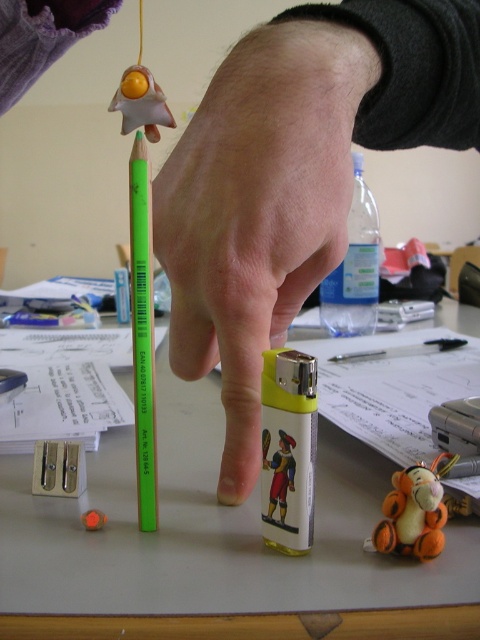
Question: Which object is the closest to the rubber eraser at center?

Choices:
 (A) green plastic pencil at center
 (B) yellow matte lighter at center

Answer: (A)

Question: Which point is farther from the camera taking this photo?

Choices:
 (A) (144, 490)
 (B) (88, 512)
 (C) (71, 515)

Answer: (C)

Question: Among these objects, which one is farthest from the camera?

Choices:
 (A) rubber eraser at center
 (B) green plastic pencil at center

Answer: (A)

Question: Considering the relative positions of yellow matte lighter at center and rubber eraser at center in the image provided, where is yellow matte lighter at center located with respect to rubber eraser at center?

Choices:
 (A) right
 (B) left

Answer: (A)

Question: Is white plastic table at center to the left of green plastic pencil at center from the viewer's perspective?

Choices:
 (A) yes
 (B) no

Answer: (B)

Question: Is white plastic table at center closer to the viewer compared to yellow matte lighter at center?

Choices:
 (A) no
 (B) yes

Answer: (B)